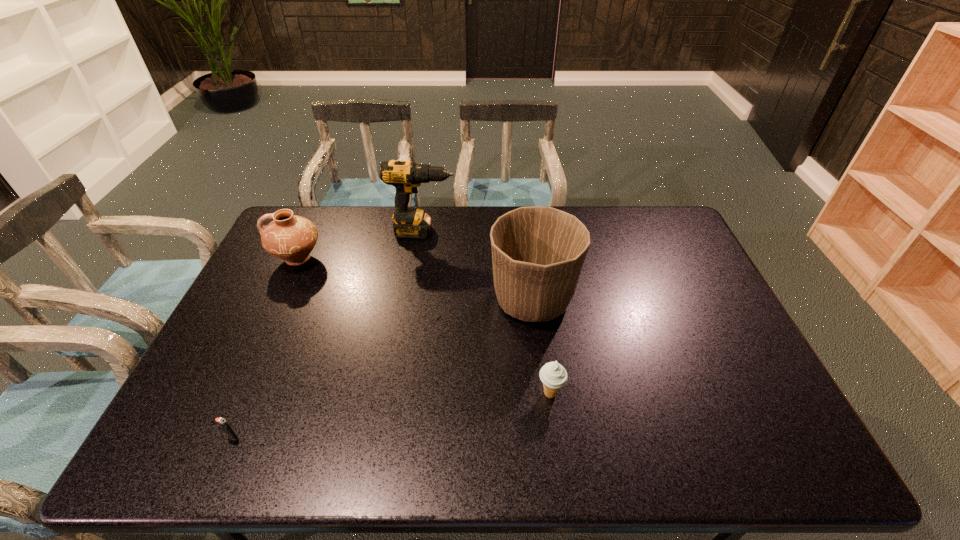
Locate an element on the screen. blank region between the fourth farthest object and the flowerpot is located at coordinates (541, 347).

Where is `free space that is in between the nearest object and the second shortest object`? free space that is in between the nearest object and the second shortest object is located at coordinates (392, 415).

You are a GUI agent. You are given a task and a screenshot of the screen. Output one action in this format:
    pyautogui.click(x=<x>, y=<y>)
    Task: Click on the vacant space in between the igniter and the pottery
    The image size is (960, 540).
    Given the screenshot: What is the action you would take?
    pyautogui.click(x=266, y=348)

Where is `object that is the nearest to the flowerpot`? object that is the nearest to the flowerpot is located at coordinates click(x=553, y=375).

Locate which object is the third closest to the fourth farthest object. Please provide its 2D coordinates. Your answer should be formatted as a tuple, i.e. [(x, y)], where the tuple contains the x and y coordinates of a point satisfying the conditions above.

[(222, 422)]

What are the coordinates of `vacant space that satisfies the following two spatial constraints: 1. at the tip of the second shortest object; 2. on the right side of the third object from right to left` in the screenshot? It's located at (398, 393).

The image size is (960, 540). In order to click on vacant space that satisfies the following two spatial constraints: 1. at the tip of the farthest object; 2. on the back side of the flowerpot in this screenshot , I will do `click(413, 300)`.

The image size is (960, 540). I want to click on vacant space that satisfies the following two spatial constraints: 1. at the tip of the drill; 2. on the left side of the flowerpot, so (x=413, y=300).

Find the location of a particular element. The height and width of the screenshot is (540, 960). free spot that satisfies the following two spatial constraints: 1. at the tip of the fourth tallest object; 2. on the left side of the drill is located at coordinates (398, 393).

Locate an element on the screen. The height and width of the screenshot is (540, 960). vacant area in the image that satisfies the following two spatial constraints: 1. at the tip of the third object from left to right; 2. on the right side of the flowerpot is located at coordinates (413, 300).